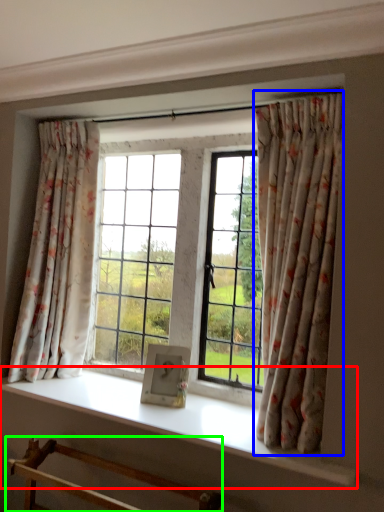
Question: Based on their relative distances, which object is farther from window sill (highlighted by a red box)? Choose from curtain (highlighted by a blue box) and furniture (highlighted by a green box).

Choices:
 (A) curtain
 (B) furniture

Answer: (A)